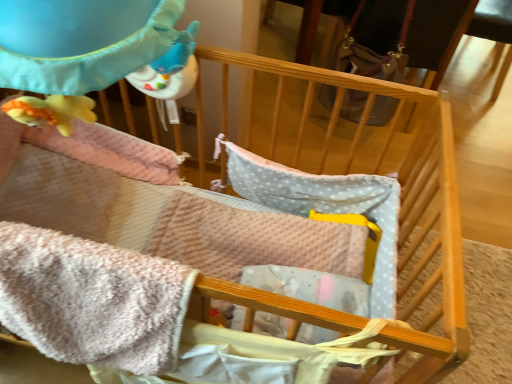
Identify the location of pink plush blanket at lower left. This screenshot has height=384, width=512. (92, 299).

What do you see at coordinates (92, 299) in the screenshot? I see `pink plush blanket at lower left` at bounding box center [92, 299].

What is the approximate height of pink plush blanket at lower left?

pink plush blanket at lower left is 14.77 inches tall.

You are a GUI agent. You are given a task and a screenshot of the screen. Output one action in this format:
    pyautogui.click(x=<x>, y=<y>)
    Task: Click on the leather-like brown bag at upper right
    This screenshot has width=512, height=384.
    Given the screenshot: What is the action you would take?
    pyautogui.click(x=407, y=36)

What do you see at coordinates (407, 36) in the screenshot?
I see `leather-like brown bag at upper right` at bounding box center [407, 36].

Where is `pink plush blanket at lower left`? pink plush blanket at lower left is located at coordinates (92, 299).

Which object is positioned more to the right, pink plush blanket at lower left or leather-like brown bag at upper right?

leather-like brown bag at upper right.

Is pink plush blanket at lower left positioned behind leather-like brown bag at upper right?

No, pink plush blanket at lower left is closer to the camera.

Which is closer to the camera, (79, 278) or (378, 0)?

Point (79, 278) is closer to the camera than point (378, 0).

From the image's perspective, is pink plush blanket at lower left beneath leather-like brown bag at upper right?

Yes.

In the scene shown: From a real-world perspective, is pink plush blanket at lower left above or below leather-like brown bag at upper right?

pink plush blanket at lower left is above leather-like brown bag at upper right.

Between pink plush blanket at lower left and leather-like brown bag at upper right, which one has larger width?

Wider between the two is leather-like brown bag at upper right.

Can you confirm if pink plush blanket at lower left is taller than leather-like brown bag at upper right?

No.

Considering the sizes of pink plush blanket at lower left and leather-like brown bag at upper right in the image, is pink plush blanket at lower left bigger or smaller than leather-like brown bag at upper right?

In the image, pink plush blanket at lower left appears to be smaller than leather-like brown bag at upper right.

Is leather-like brown bag at upper right completely or partially inside pink plush blanket at lower left?

No, leather-like brown bag at upper right is located outside of pink plush blanket at lower left.

Are pink plush blanket at lower left and leather-like brown bag at upper right far apart?

Indeed, pink plush blanket at lower left is not near leather-like brown bag at upper right.

Could you tell me if pink plush blanket at lower left is facing leather-like brown bag at upper right?

No, pink plush blanket at lower left is not facing towards leather-like brown bag at upper right.

Locate an element on the screen. feeding chair on the right of pink plush blanket at lower left is located at coordinates (407, 36).

Is leather-like brown bag at upper right to the right of pink plush blanket at lower left from the viewer's perspective?

Yes, leather-like brown bag at upper right is to the right of pink plush blanket at lower left.

Based on the photo, which object is further away from the camera taking this photo, leather-like brown bag at upper right or pink plush blanket at lower left?

Positioned behind is leather-like brown bag at upper right.

Does point (388, 19) come farther from viewer compared to point (70, 360)?

Yes, it is.

From the image's perspective, is leather-like brown bag at upper right located above or below pink plush blanket at lower left?

From the image's perspective, leather-like brown bag at upper right appears above pink plush blanket at lower left.

From a real-world perspective, is leather-like brown bag at upper right under pink plush blanket at lower left?

Indeed, from a real-world perspective, leather-like brown bag at upper right is positioned beneath pink plush blanket at lower left.

Considering the relative sizes of leather-like brown bag at upper right and pink plush blanket at lower left in the image provided, is leather-like brown bag at upper right thinner than pink plush blanket at lower left?

No.

Which of these two, leather-like brown bag at upper right or pink plush blanket at lower left, stands shorter?

Standing shorter between the two is pink plush blanket at lower left.

Does leather-like brown bag at upper right have a larger size compared to pink plush blanket at lower left?

Yes, leather-like brown bag at upper right is bigger than pink plush blanket at lower left.

Is leather-like brown bag at upper right inside or outside of pink plush blanket at lower left?

leather-like brown bag at upper right is spatially situated outside pink plush blanket at lower left.

Would you say leather-like brown bag at upper right is a long distance from pink plush blanket at lower left?

Indeed, leather-like brown bag at upper right is not near pink plush blanket at lower left.

Is leather-like brown bag at upper right facing away from pink plush blanket at lower left?

No.

Locate an element on the screen. The image size is (512, 384). feeding chair that appears above the pink plush blanket at lower left (from the image's perspective) is located at coordinates (407, 36).

Locate an element on the screen. The width and height of the screenshot is (512, 384). feeding chair on the right of pink plush blanket at lower left is located at coordinates (407, 36).

Where is `blanket above the leather-like brown bag at upper right (from a real-world perspective)`? The width and height of the screenshot is (512, 384). blanket above the leather-like brown bag at upper right (from a real-world perspective) is located at coordinates (92, 299).